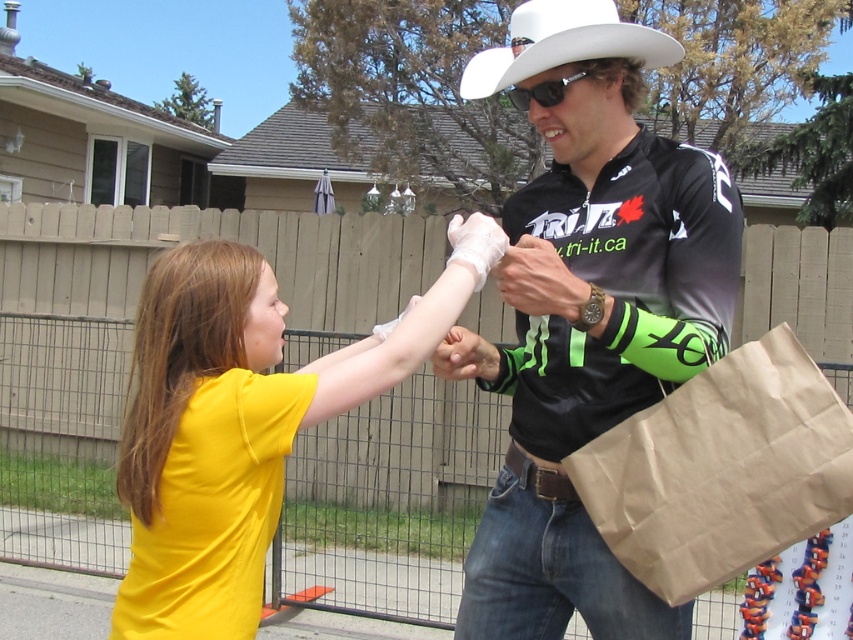
Does yellow matte shirt at center lie in front of brown paper bag at right?

No, it is behind brown paper bag at right.

Which is more to the left, yellow matte shirt at center or brown paper bag at right?

yellow matte shirt at center

Which is in front, point (163, 321) or point (703, 522)?

Point (703, 522) is more forward.

Identify the location of yellow matte shirt at center. point(242,422).

Looking at this image, does black jersey at center come in front of yellow matte shirt at center?

No, black jersey at center is further to the viewer.

Between black jersey at center and yellow matte shirt at center, which one has more height?

With more height is black jersey at center.

Image resolution: width=853 pixels, height=640 pixels. What do you see at coordinates (587, 314) in the screenshot?
I see `black jersey at center` at bounding box center [587, 314].

This screenshot has height=640, width=853. Find the location of `black jersey at center`. black jersey at center is located at coordinates (587, 314).

Is black jersey at center wider than white felt cowboy hat at upper center?

Correct, the width of black jersey at center exceeds that of white felt cowboy hat at upper center.

What do you see at coordinates (587, 314) in the screenshot? The height and width of the screenshot is (640, 853). I see `black jersey at center` at bounding box center [587, 314].

Where is `black jersey at center`? black jersey at center is located at coordinates (587, 314).